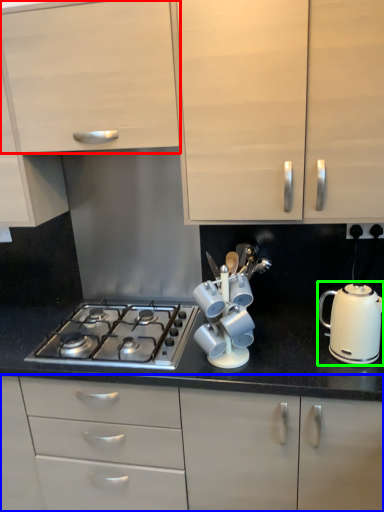
Question: Which is nearer to the cabinetry (highlighted by a red box)? cabinetry (highlighted by a blue box) or kitchen appliance (highlighted by a green box).

Choices:
 (A) cabinetry
 (B) kitchen appliance

Answer: (B)